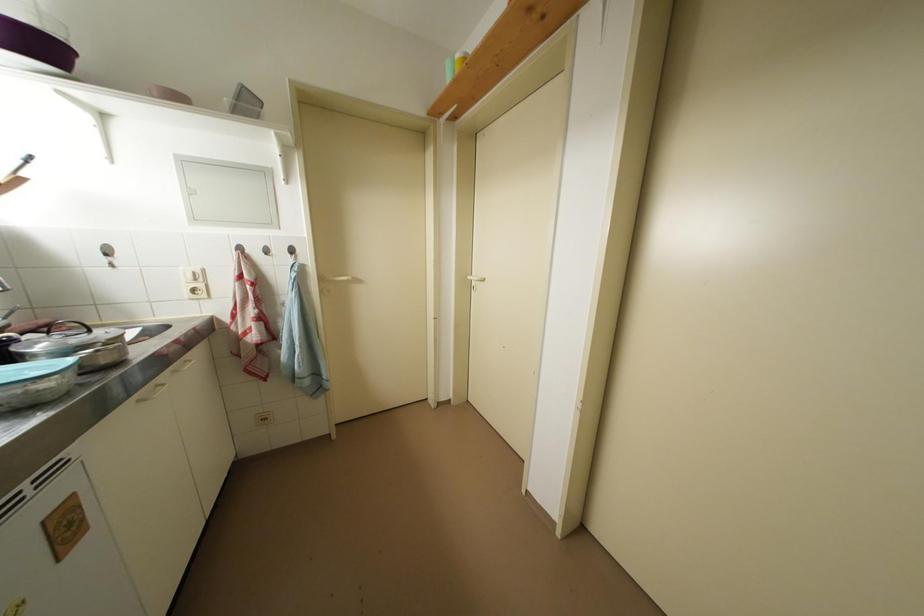
Describe the element at coordinates (80, 326) in the screenshot. I see `a pot lid handle` at that location.